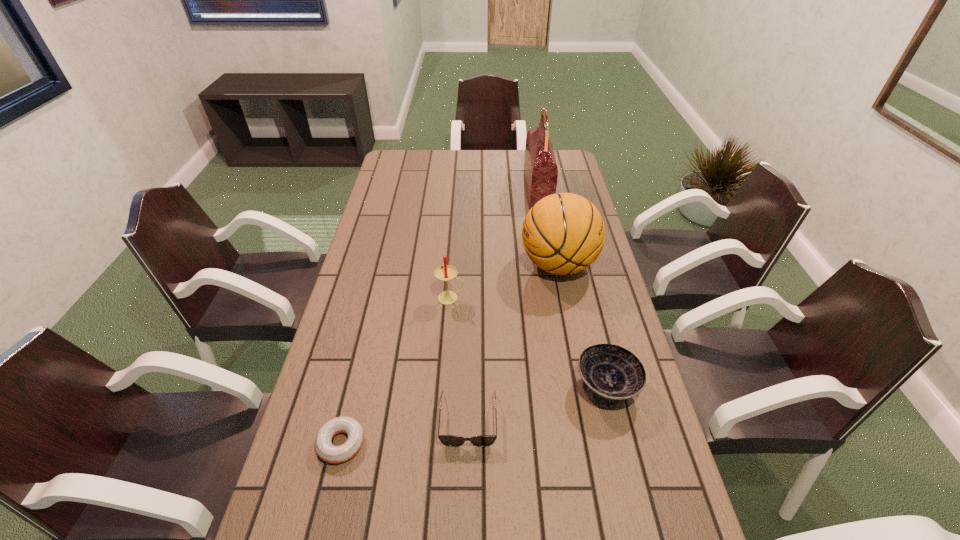
Locate an element on the screen. handbag located at the right edge is located at coordinates (540, 168).

The width and height of the screenshot is (960, 540). Find the location of `basketball located in the right edge section of the desktop`. basketball located in the right edge section of the desktop is located at coordinates (563, 233).

Image resolution: width=960 pixels, height=540 pixels. Find the location of `bowl that is at the right edge`. bowl that is at the right edge is located at coordinates (611, 374).

The image size is (960, 540). What are the coordinates of `object present at the far right corner` in the screenshot? It's located at (540, 168).

The height and width of the screenshot is (540, 960). Find the location of `free space at the far edge`. free space at the far edge is located at coordinates (515, 166).

The width and height of the screenshot is (960, 540). What are the coordinates of `free location at the left edge of the desktop` in the screenshot? It's located at (353, 349).

You are a GUI agent. You are given a task and a screenshot of the screen. Output one action in this format:
    pyautogui.click(x=<x>, y=<y>)
    Task: Click on the free region at the right edge of the desktop
    The height and width of the screenshot is (540, 960).
    Given the screenshot: What is the action you would take?
    pyautogui.click(x=608, y=328)

In the image, there is a desktop. Where is `vacant space at the far left corner`? vacant space at the far left corner is located at coordinates (389, 176).

Locate an element on the screen. This screenshot has height=540, width=960. free spot between the fourth shortest object and the handbag is located at coordinates (494, 244).

You are a GUI agent. You are given a task and a screenshot of the screen. Output one action in this format:
    pyautogui.click(x=<x>, y=<y>)
    Task: Click on the free spot between the bowl and the fifth shortest object
    The height and width of the screenshot is (540, 960).
    Given the screenshot: What is the action you would take?
    pyautogui.click(x=583, y=326)